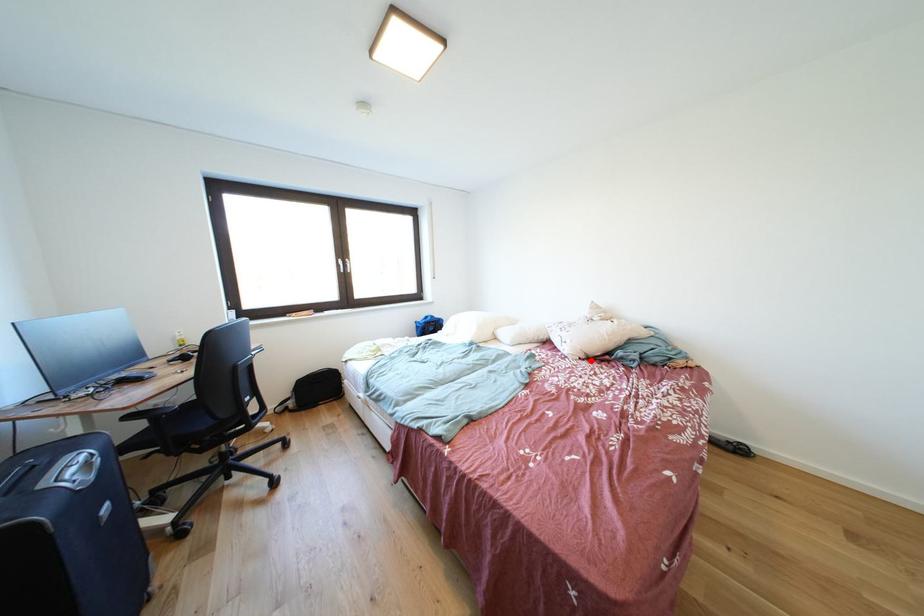
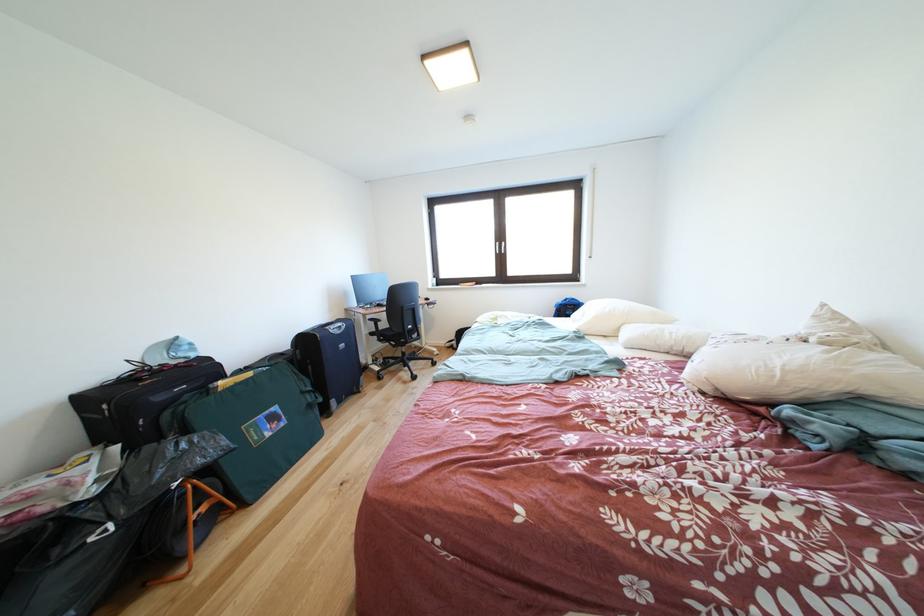
Locate, in the second image, the point that corresponds to the highlighted location in the first image.

(716, 394)